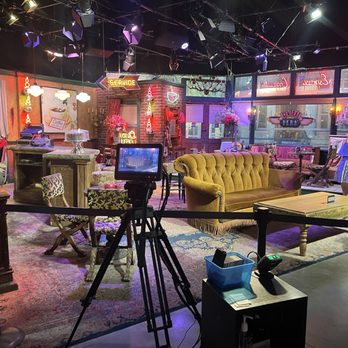
Identify the location of door window. The height and width of the screenshot is (348, 348). (199, 133), (213, 133).